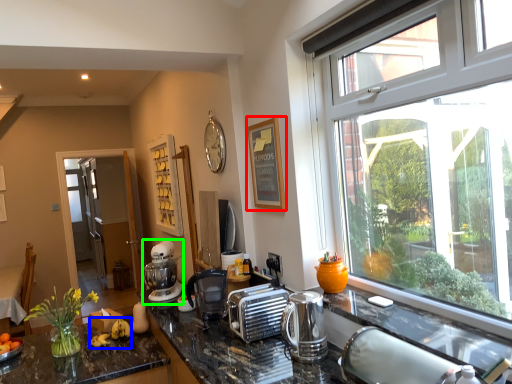
Question: Considering the real-world distances, which object is closest to picture frame (highlighted by a red box)? banana (highlighted by a blue box) or mixer (highlighted by a green box).

Choices:
 (A) banana
 (B) mixer

Answer: (B)